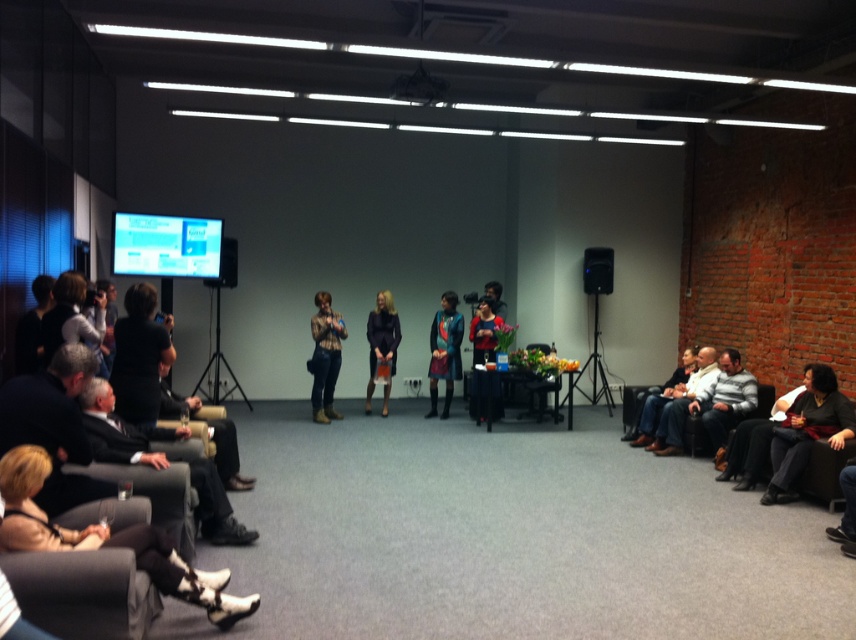
Who is shorter, dark gray fabric chair at lower left or black plastic speaker at right?

black plastic speaker at right

Can you confirm if dark gray fabric chair at lower left is shorter than black plastic speaker at right?

No.

Is point (214, 490) in front of point (601, 250)?

Yes, point (214, 490) is in front of point (601, 250).

Find the location of a particular element. The width and height of the screenshot is (856, 640). dark gray fabric chair at lower left is located at coordinates (120, 429).

Is matte black jacket at center to the right of matte black speaker at center from the viewer's perspective?

Correct, you'll find matte black jacket at center to the right of matte black speaker at center.

Can you confirm if matte black jacket at center is smaller than matte black speaker at center?

Incorrect, matte black jacket at center is not smaller in size than matte black speaker at center.

Where is `matte black jacket at center`? The height and width of the screenshot is (640, 856). matte black jacket at center is located at coordinates (484, 330).

Is matte black dress at center positioned at the back of jeans at right?

Yes.

Can you confirm if matte black dress at center is smaller than jeans at right?

Yes, matte black dress at center is smaller than jeans at right.

Locate an element on the screen. This screenshot has height=640, width=856. matte black dress at center is located at coordinates (381, 344).